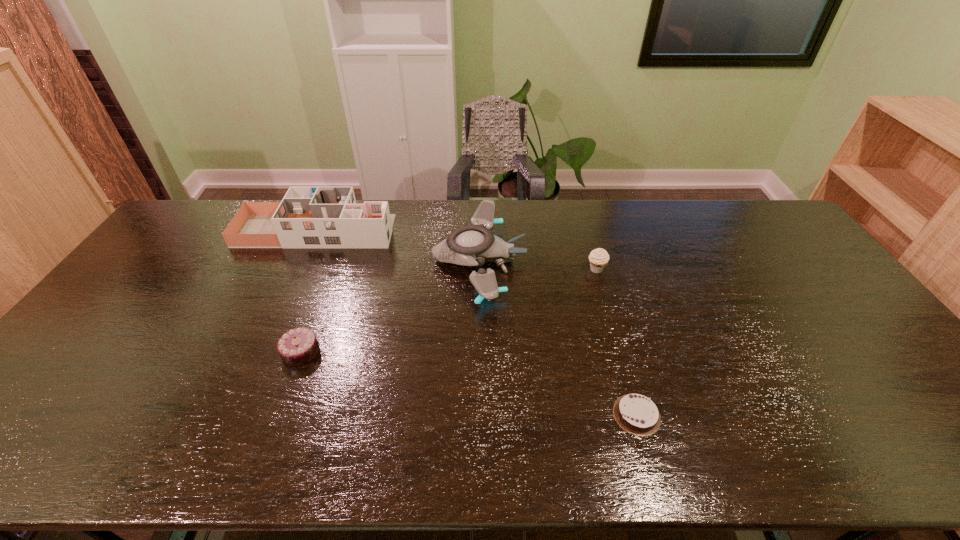
The width and height of the screenshot is (960, 540). Find the location of `dollhouse`. dollhouse is located at coordinates (307, 217).

Where is `the third object from left to right`? The width and height of the screenshot is (960, 540). the third object from left to right is located at coordinates (471, 245).

You are a GUI agent. You are given a task and a screenshot of the screen. Output one action in this format:
    pyautogui.click(x=<x>, y=<y>)
    Task: Click on the fourth shortest object
    
    Given the screenshot: What is the action you would take?
    pyautogui.click(x=471, y=245)

Locate an element on the screen. The image size is (960, 540). the third tallest object is located at coordinates (598, 258).

Locate an element on the screen. Image resolution: width=960 pixels, height=540 pixels. the fourth tallest object is located at coordinates (299, 346).

You are a GUI agent. You are given a task and a screenshot of the screen. Output one action in this format:
    pyautogui.click(x=<x>, y=<y>)
    Task: Click on the left chocolate cake
    
    Given the screenshot: What is the action you would take?
    pyautogui.click(x=299, y=346)

Identify the location of the right chocolate cake. (638, 415).

This screenshot has height=540, width=960. Find the location of `the nearest object`. the nearest object is located at coordinates (638, 415).

Where is `free region located 0.070m at the front door of the dollhouse`? Image resolution: width=960 pixels, height=540 pixels. free region located 0.070m at the front door of the dollhouse is located at coordinates (413, 231).

This screenshot has height=540, width=960. I want to click on vacant space located 0.070m on the front-facing side of the second tallest object, so click(546, 260).